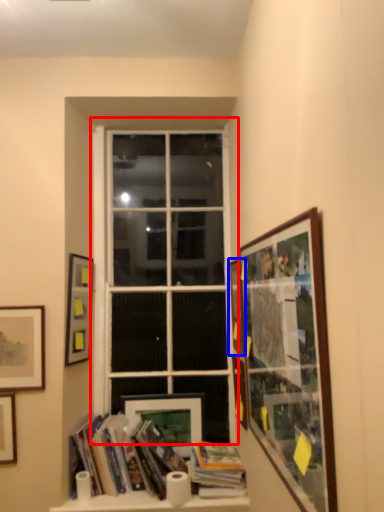
Question: Which object appears closest to the camera in this image, window (highlighted by a red box) or picture frame (highlighted by a blue box)?

Choices:
 (A) window
 (B) picture frame

Answer: (B)